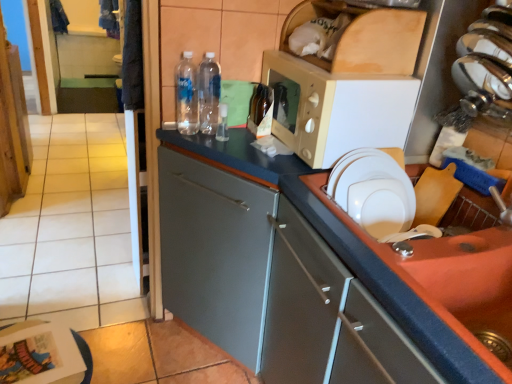
Where is `vacant area in front of translucent glass bottle at center, the third bottle viewed from the left`? The height and width of the screenshot is (384, 512). vacant area in front of translucent glass bottle at center, the third bottle viewed from the left is located at coordinates (256, 147).